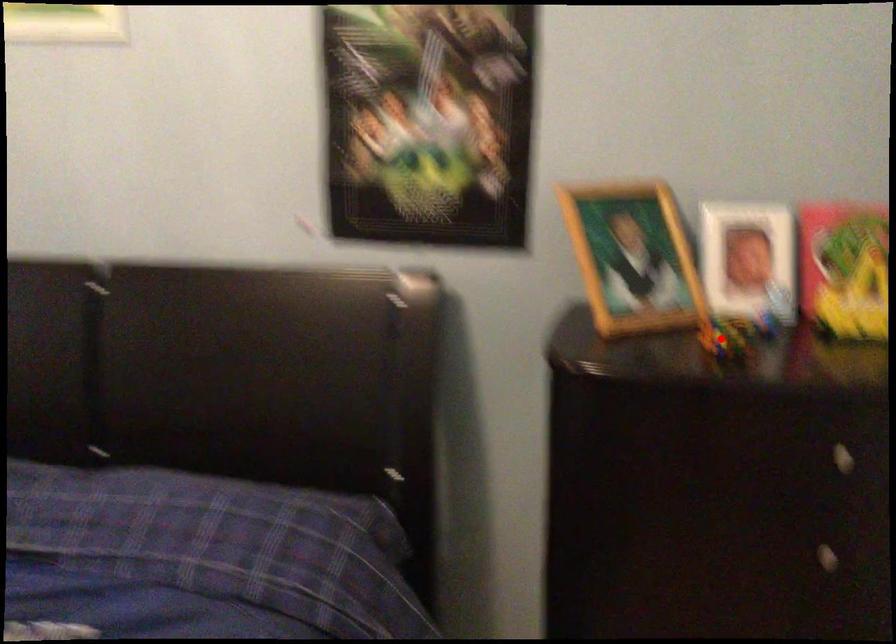
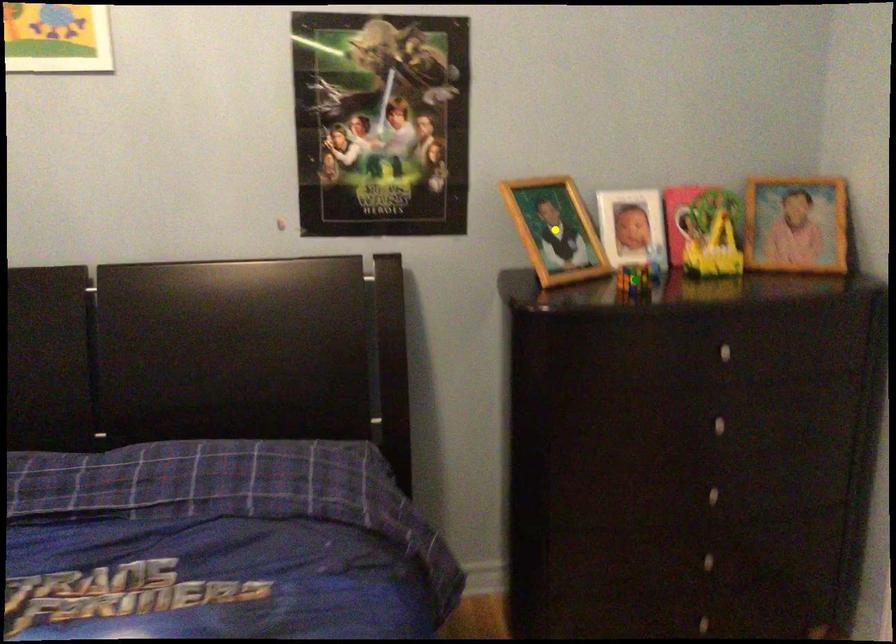
Question: I am providing you with two images of the same scene from different viewpoints. A red point is marked on the first image. You are given multiple points on the second image. Which point in image 2 is actually the same real-world point as the red point in image 1?

Choices:
 (A) green point
 (B) blue point
 (C) yellow point

Answer: (A)